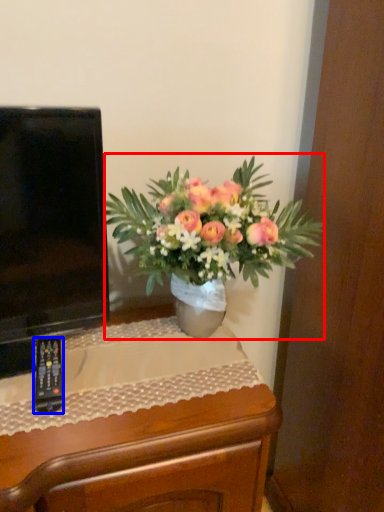
Question: Which object is further to the camera taking this photo, houseplant (highlighted by a red box) or remote control (highlighted by a blue box)?

Choices:
 (A) houseplant
 (B) remote control

Answer: (B)